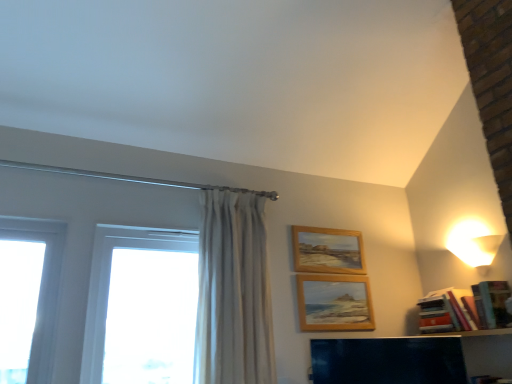
Question: From the image's perspective, would you say white glass window at left is positioned over white glossy lampshade at upper right?

Choices:
 (A) no
 (B) yes

Answer: (A)

Question: Is white glass window at left further to camera compared to white glossy lampshade at upper right?

Choices:
 (A) no
 (B) yes

Answer: (A)

Question: Is white glass window at left shorter than white glossy lampshade at upper right?

Choices:
 (A) yes
 (B) no

Answer: (B)

Question: Considering the relative sizes of white glass window at left and white glossy lampshade at upper right in the image provided, is white glass window at left thinner than white glossy lampshade at upper right?

Choices:
 (A) no
 (B) yes

Answer: (B)

Question: Does white glass window at left lie in front of white glossy lampshade at upper right?

Choices:
 (A) yes
 (B) no

Answer: (A)

Question: From a real-world perspective, does white glass window at left stand above white glossy lampshade at upper right?

Choices:
 (A) no
 (B) yes

Answer: (A)

Question: From the image's perspective, is wooden picture frame at center, which appears as the 2th picture frame when viewed from the top, located beneath white glass window at left?

Choices:
 (A) no
 (B) yes

Answer: (B)

Question: Is wooden picture frame at center, which appears as the 2th picture frame when viewed from the top, to the left of white glass window at left from the viewer's perspective?

Choices:
 (A) no
 (B) yes

Answer: (A)

Question: Is wooden picture frame at center, which ranks as the 1th picture frame in bottom-to-top order, facing away from white glass window at left?

Choices:
 (A) yes
 (B) no

Answer: (B)

Question: Is wooden picture frame at center, which ranks as the 1th picture frame in bottom-to-top order, to the right of white glass window at left from the viewer's perspective?

Choices:
 (A) yes
 (B) no

Answer: (A)

Question: Is wooden picture frame at center, which ranks as the 1th picture frame in bottom-to-top order, thinner than white glass window at left?

Choices:
 (A) no
 (B) yes

Answer: (B)

Question: Considering the relative sizes of wooden picture frame at center, which ranks as the 1th picture frame in bottom-to-top order, and white glass window at left in the image provided, is wooden picture frame at center, which ranks as the 1th picture frame in bottom-to-top order, wider than white glass window at left?

Choices:
 (A) no
 (B) yes

Answer: (A)

Question: From a real-world perspective, is hardcover books at right positioned over wooden shelf at lower right based on gravity?

Choices:
 (A) yes
 (B) no

Answer: (A)